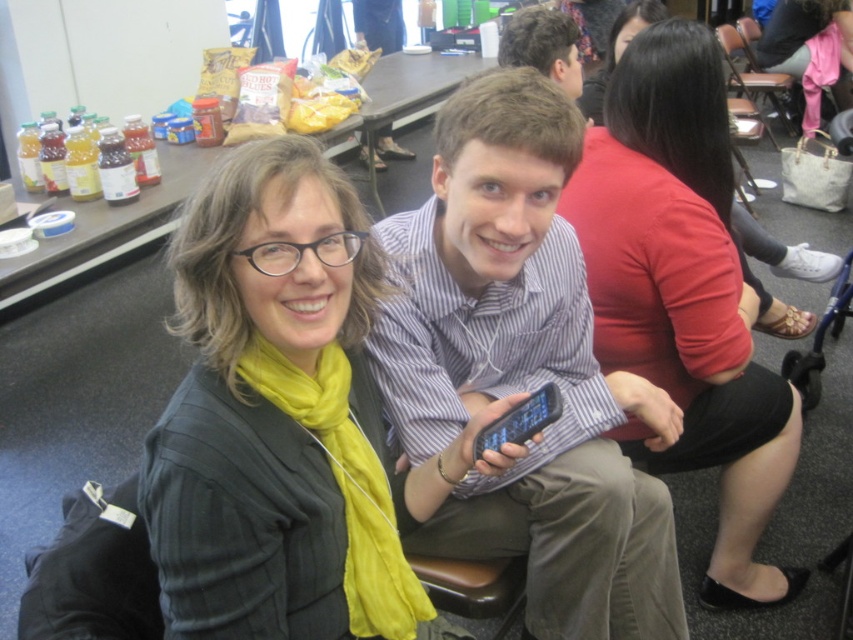
Question: Is matte black blazer at center closer to the viewer compared to striped cotton shirt at center?

Choices:
 (A) yes
 (B) no

Answer: (A)

Question: Which point is farther to the camera?

Choices:
 (A) click(x=755, y=113)
 (B) click(x=334, y=273)
 (C) click(x=630, y=432)

Answer: (A)

Question: Based on their relative distances, which object is nearer to the matte black blazer at center?

Choices:
 (A) brown leather chair at upper right
 (B) striped cotton shirt at center
 (C) matte red blouse at center

Answer: (B)

Question: Is matte black blazer at center behind matte red blouse at center?

Choices:
 (A) no
 (B) yes

Answer: (A)

Question: Does pink fabric at upper right have a greater width compared to matte black shirt at upper center?

Choices:
 (A) yes
 (B) no

Answer: (A)

Question: Which point is farther to the camera?

Choices:
 (A) (439, 280)
 (B) (676, 198)
 (C) (727, 56)

Answer: (C)